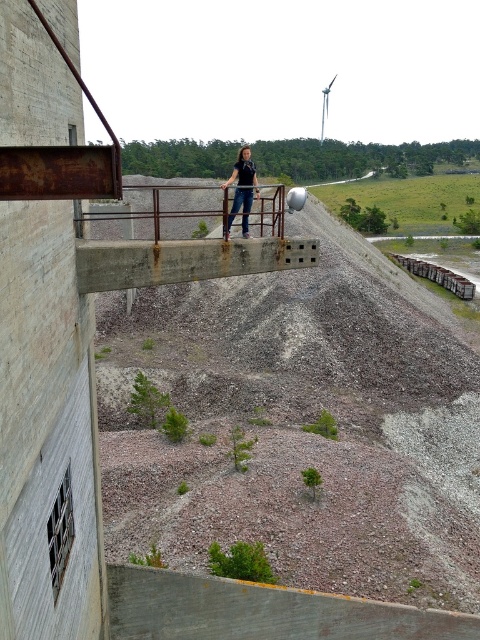
Does gray gravel at center appear on the left side of rusty metal balustrade at center?

No, gray gravel at center is not to the left of rusty metal balustrade at center.

Describe the element at coordinates (300, 424) in the screenshot. I see `gray gravel at center` at that location.

Find the location of a particular element. The height and width of the screenshot is (640, 480). gray gravel at center is located at coordinates (300, 424).

Between rusty metal balustrade at center and rusty metal rail at center, which one appears on the left side from the viewer's perspective?

From the viewer's perspective, rusty metal balustrade at center appears more on the left side.

Who is higher up, rusty metal balustrade at center or rusty metal rail at center?

rusty metal balustrade at center is higher up.

Which is in front, point (296, 260) or point (422, 262)?

Point (296, 260)

Locate an element on the screen. Image resolution: width=480 pixels, height=640 pixels. rusty metal balustrade at center is located at coordinates (184, 259).

Based on the photo, who is more distant from viewer, (405, 480) or (250, 154)?

The point (250, 154) is behind.

Can you confirm if gray gravel at center is positioned below denim jeans at center?

Indeed, gray gravel at center is positioned under denim jeans at center.

Does point (107, 515) come closer to viewer compared to point (235, 216)?

No, it is behind (235, 216).

Locate an element on the screen. The height and width of the screenshot is (640, 480). gray gravel at center is located at coordinates (300, 424).